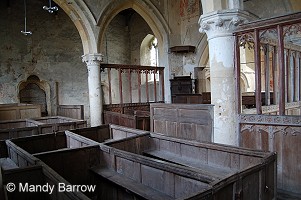
This screenshot has height=200, width=301. I want to click on archways, so click(67, 8), click(130, 3), click(146, 36), click(205, 44).